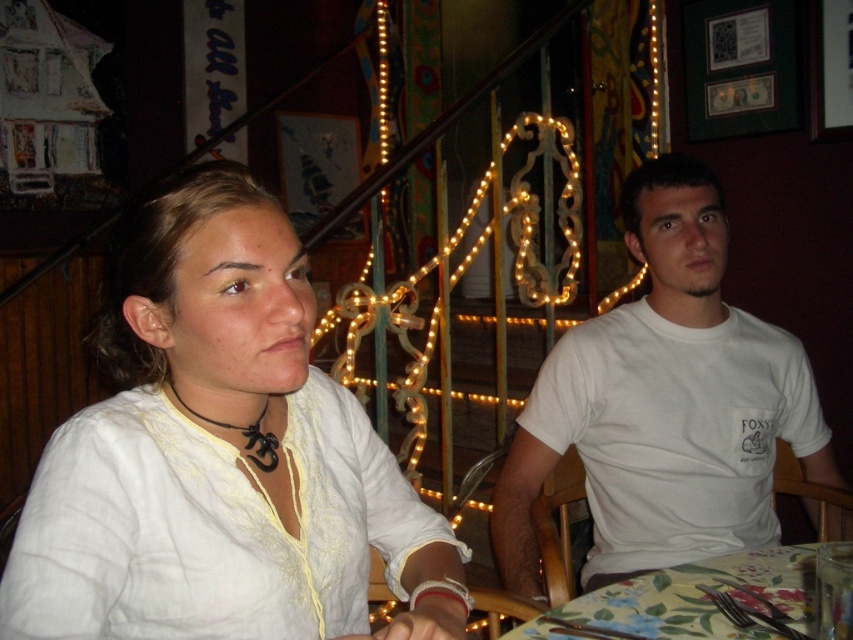
Which is below, white cotton t-shirt at right or floral fabric tablecloth at lower center?

Positioned lower is floral fabric tablecloth at lower center.

What do you see at coordinates (664, 403) in the screenshot? Image resolution: width=853 pixels, height=640 pixels. I see `white cotton t-shirt at right` at bounding box center [664, 403].

At what (x,y) coordinates should I click in order to perform the action: click on white cotton t-shirt at right. Please return your answer as a coordinate pair (x, y). The height and width of the screenshot is (640, 853). Looking at the image, I should click on (664, 403).

How distant is white cotton shirt at upper left from white cotton t-shirt at right?

white cotton shirt at upper left and white cotton t-shirt at right are 25.55 inches apart from each other.

You are a GUI agent. You are given a task and a screenshot of the screen. Output one action in this format:
    pyautogui.click(x=<x>, y=<y>)
    Task: Click on the white cotton shirt at upper left
    
    Given the screenshot: What is the action you would take?
    pyautogui.click(x=219, y=452)

Is point (227, 161) more distant than point (766, 403)?

No.

You are a GUI agent. You are given a task and a screenshot of the screen. Output one action in this format:
    pyautogui.click(x=<x>, y=<y>)
    Task: Click on the white cotton shirt at upper left
    The width and height of the screenshot is (853, 640).
    Given the screenshot: What is the action you would take?
    219,452

Can you confirm if white cotton shirt at upper left is positioned below floral fabric tablecloth at lower center?

Incorrect, white cotton shirt at upper left is not positioned below floral fabric tablecloth at lower center.

Locate an element on the screen. The image size is (853, 640). white cotton shirt at upper left is located at coordinates click(x=219, y=452).

Is point (45, 589) positioned before point (695, 611)?

Yes, point (45, 589) is closer to viewer.

Identify the location of white cotton shirt at upper left. Image resolution: width=853 pixels, height=640 pixels. (219, 452).